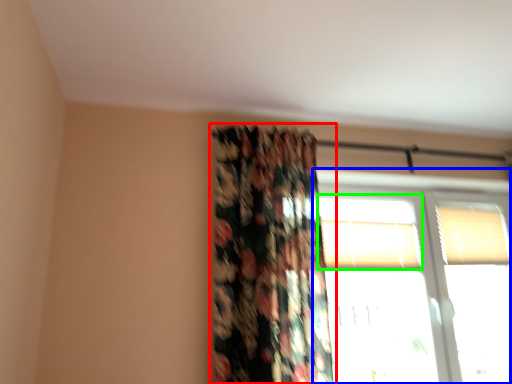
Question: Which is nearer to the curtain (highlighted by a red box)? window (highlighted by a blue box) or window (highlighted by a green box).

Choices:
 (A) window
 (B) window

Answer: (B)